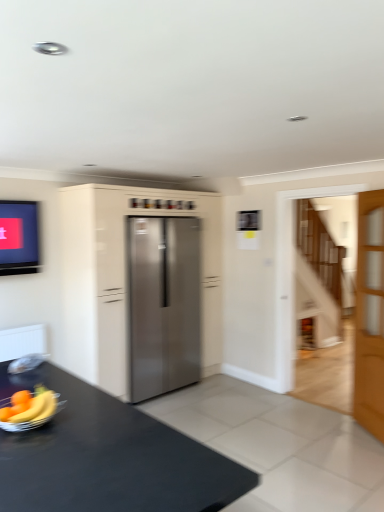
Question: Should I look upward or downward to see black matte table at lower left?

Choices:
 (A) down
 (B) up

Answer: (A)

Question: Is stainless steel refrigerator at center not near stainless steel refrigerator at center?

Choices:
 (A) no
 (B) yes

Answer: (A)

Question: From the image's perspective, is stainless steel refrigerator at center under stainless steel refrigerator at center?

Choices:
 (A) no
 (B) yes

Answer: (B)

Question: Would you say stainless steel refrigerator at center contains stainless steel refrigerator at center?

Choices:
 (A) yes
 (B) no

Answer: (A)

Question: Does stainless steel refrigerator at center have a lesser width compared to stainless steel refrigerator at center?

Choices:
 (A) yes
 (B) no

Answer: (B)

Question: Does stainless steel refrigerator at center come in front of stainless steel refrigerator at center?

Choices:
 (A) no
 (B) yes

Answer: (A)

Question: Can you confirm if stainless steel refrigerator at center is wider than stainless steel refrigerator at center?

Choices:
 (A) yes
 (B) no

Answer: (A)

Question: Considering the relative sizes of stainless steel refrigerator at center and yellow matte banana at lower left in the image provided, is stainless steel refrigerator at center wider than yellow matte banana at lower left?

Choices:
 (A) yes
 (B) no

Answer: (A)

Question: Is stainless steel refrigerator at center taller than yellow matte banana at lower left?

Choices:
 (A) yes
 (B) no

Answer: (A)

Question: Is stainless steel refrigerator at center at the left side of yellow matte banana at lower left?

Choices:
 (A) no
 (B) yes

Answer: (A)

Question: Does stainless steel refrigerator at center have a smaller size compared to yellow matte banana at lower left?

Choices:
 (A) no
 (B) yes

Answer: (A)

Question: Does stainless steel refrigerator at center have a larger size compared to yellow matte banana at lower left?

Choices:
 (A) yes
 (B) no

Answer: (A)

Question: Is yellow matte banana at lower left a part of stainless steel refrigerator at center?

Choices:
 (A) no
 (B) yes

Answer: (A)

Question: Is light brown wooden door at right not inside stainless steel refrigerator at center?

Choices:
 (A) yes
 (B) no

Answer: (A)